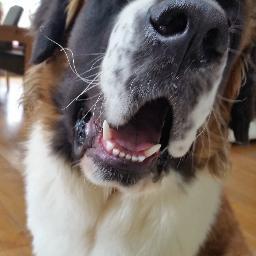
Find the location of a particular element. The image size is (256, 256). table is located at coordinates (12, 35).